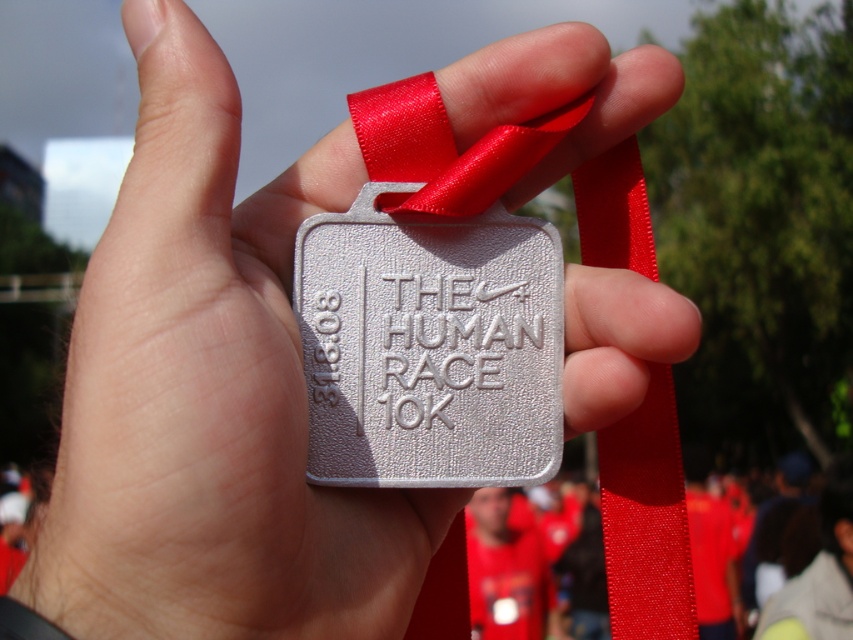
You are a photographer trying to capture a closeup of the silver textured medal at center and the red satin ribbon at center. If your camera has a minimum focus distance of 2.5 inches, can you focus on both objects without moving the camera closer?

The distance between the silver textured medal at center and the red satin ribbon at center is 2.82 inches. Since the minimum focus distance is 2.5 inches, the camera can focus on both objects without needing to move closer.

You are a photographer taking a close up of a medal. You notice the silver textured medal at center and the red satin ribbon at center. Which object is closer to you in the photo?

Result: The silver textured medal at center is closer to you than the red satin ribbon at center.